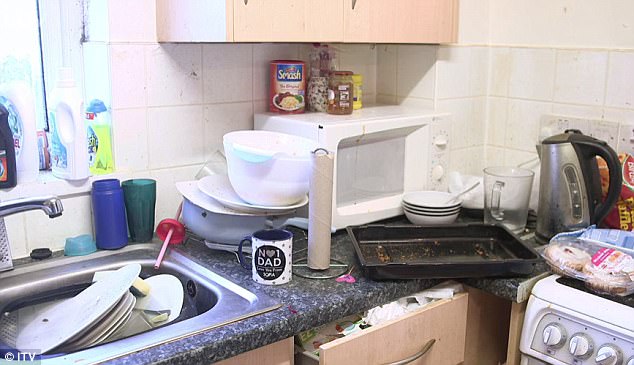
At what (x,y) coordinates should I click in order to perform the action: click on dark marble counter top. Please return your answer as a coordinate pair (x, y). Looking at the image, I should click on (325, 304).